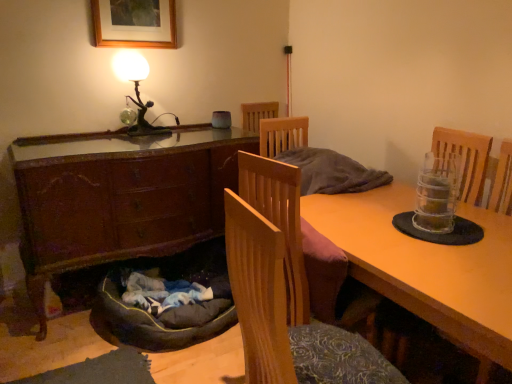
At what (x,y) coordinates should I click in order to perform the action: click on vacant area that is situated to the right of metallic figure at upper left. Please return your answer as a coordinate pair (x, y). Looking at the image, I should click on (178, 137).